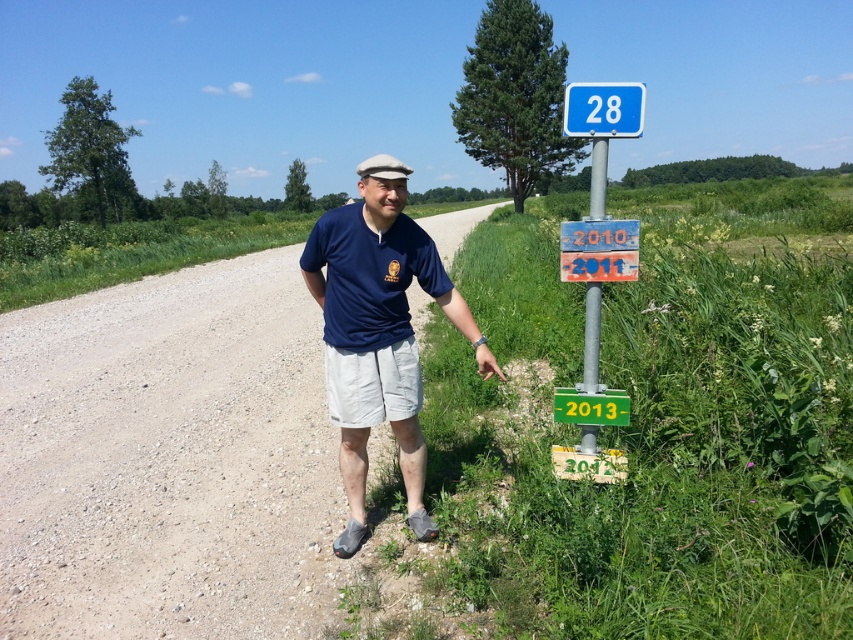
You are a tourist standing on the gravel path and want to read the text on the blue plastic sign at upper right. Can you read it clearly without moving closer?

The blue plastic sign at upper right is 9.13 feet from viewer, so yes, you can read it clearly without moving closer as it is within a comfortable reading distance.